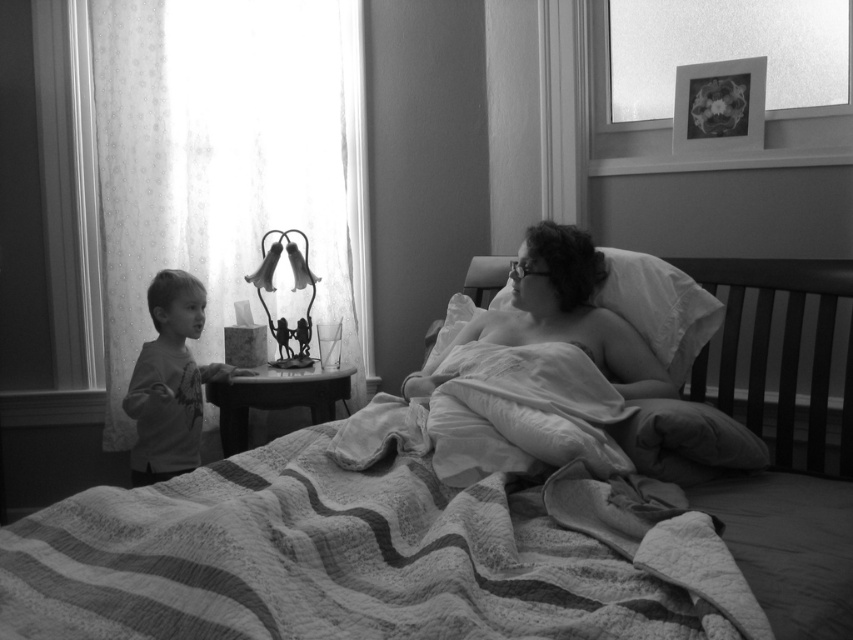
You are a photographer adjusting your camera settings to capture the scene. You notice the smooth gray shirt at left and the metallic wire lamp at center. Which object should you focus on first if you want to ensure both are in sharp focus, given their positions relative to the camera?

You should focus on the metallic wire lamp at center first because the smooth gray shirt at left is closer to the viewer. By focusing on the farther object, you can maximize the depth of field to keep both in focus.

In the scene shown: You are a photographer setting up a shoot in this bedroom. You have a smooth gray shirt at left and a metallic wire lamp at center. Which object should you focus on if you want to capture the wider object in your frame?

The smooth gray shirt at left should be focused on because its width is larger than the metallic wire lamp at center.